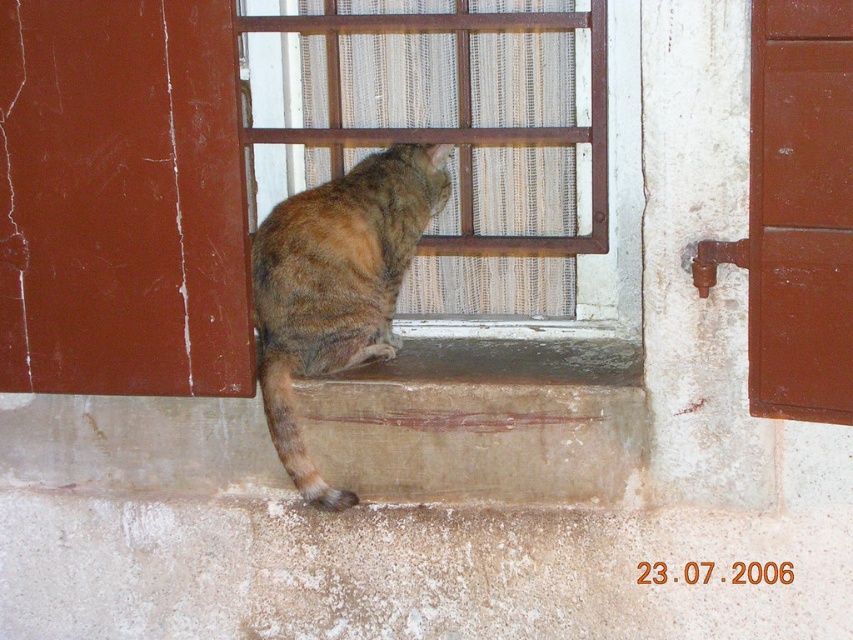
Is brown woven fabric at center shorter than tabby fur cat at lower center?

Yes.

How much distance is there between brown woven fabric at center and tabby fur cat at lower center?

A distance of 10.53 inches exists between brown woven fabric at center and tabby fur cat at lower center.

Does point (480, 177) come in front of point (287, 388)?

No.

Locate an element on the screen. brown woven fabric at center is located at coordinates (457, 81).